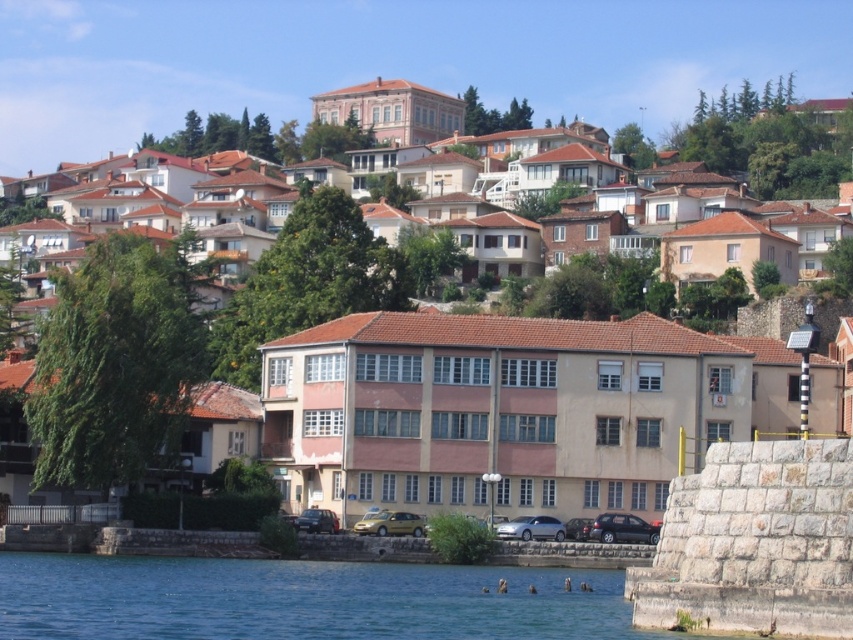
You are standing at the point with coordinates 0.719, 0.458. You want to walk to the gold metallic car at center. In which direction should you move?

You should move east to reach the gold metallic car at center because your current position is west of it.